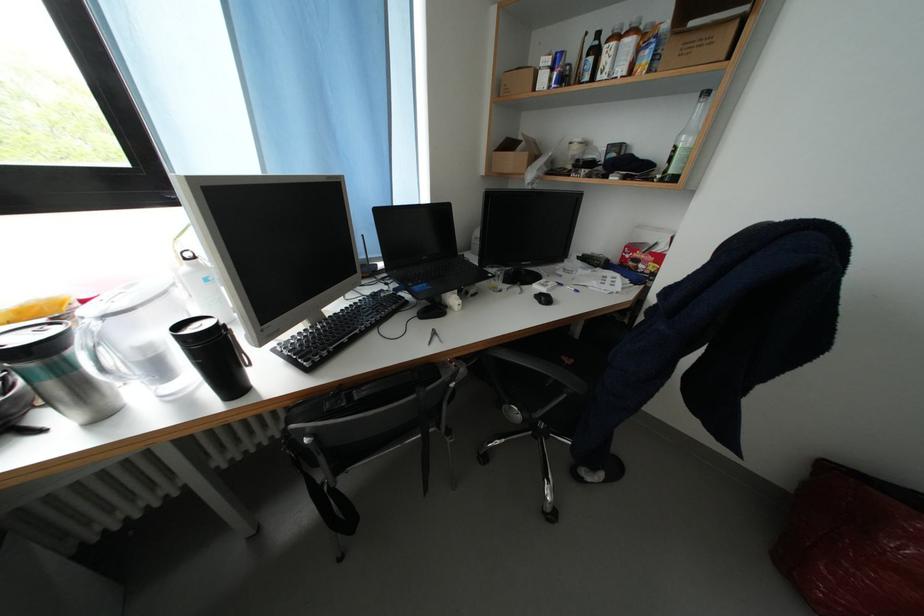
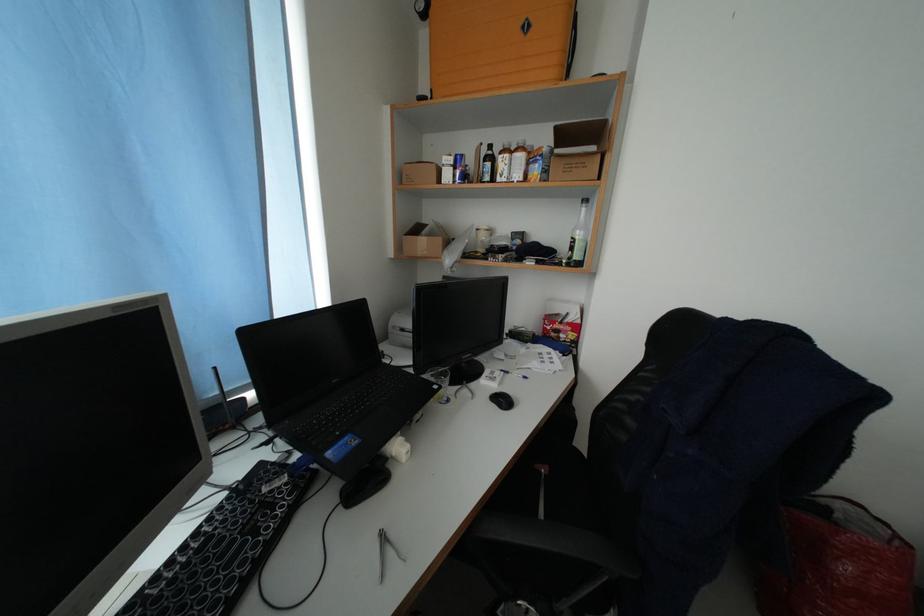
Find the pixel in the second image that matches [622,50] in the first image.

(515, 161)